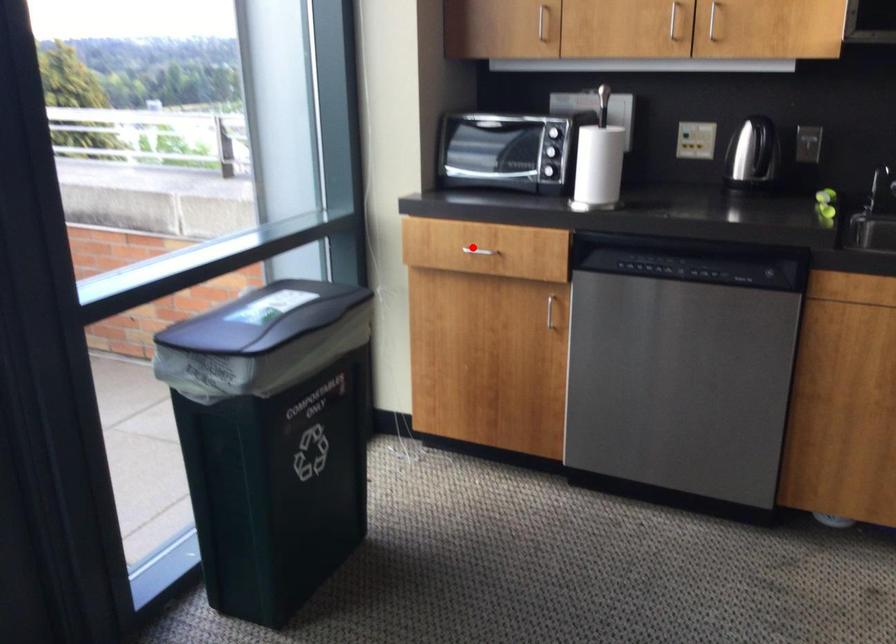
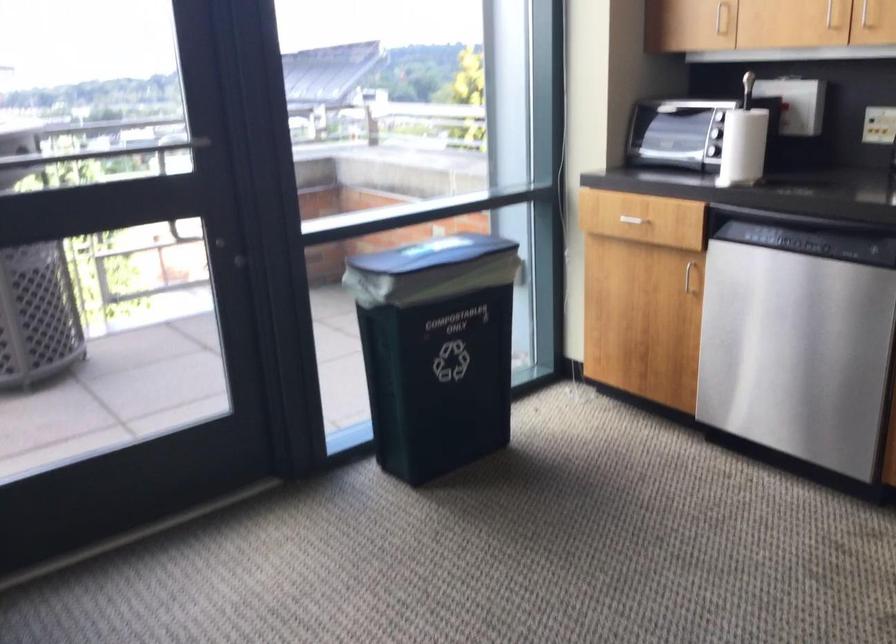
Question: A red point is marked in image1. In image2, is the corresponding 3D point closer to the camera or farther? Reply with the corresponding letter.

Choices:
 (A) The corresponding 3D point is closer.
 (B) The corresponding 3D point is farther.

Answer: (B)